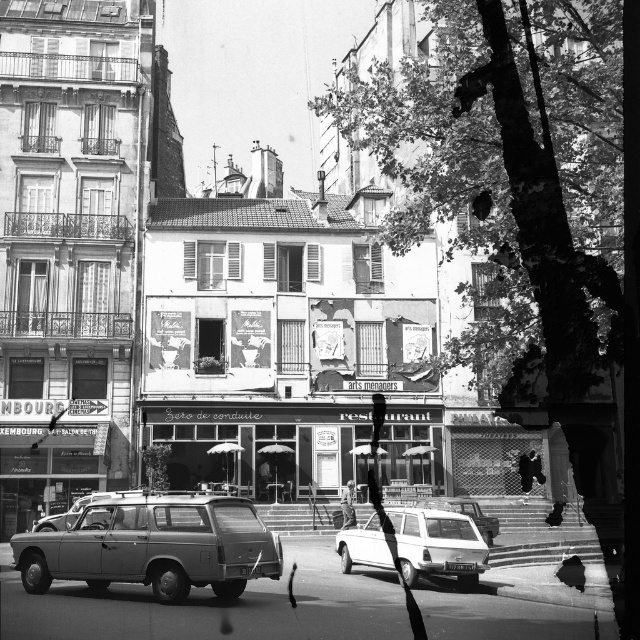
In the scene shown: You are a photographer standing at the center of the street facing the building with the restaurant. You notice two points marked on the building facade. The first point is at coordinate point (208, 516) and the second is at point (484, 563). Which of these two points is closer to your camera lens?

Point (208, 516) is closer to the camera than point (484, 563).

You are a delivery person trying to park your small van between the metallic gray station wagon at lower left and the white matte station wagon at center. Can you fit your van between them if your van is 1.8 meters wide?

The metallic gray station wagon at lower left is larger in size than the white matte station wagon at center, but the exact width between them isn not specified. Without knowing the distance between the two vehicles, it is impossible to determine if your van will fit.

You are a delivery person who needs to park a delivery van that is 2 meters wide. You see the metallic gray station wagon at lower left and the white matte station wagon at center. Is there enough space between them to park your van?

The metallic gray station wagon at lower left might be wider than the white matte station wagon at center, so there may not be enough space between them to park a 2 meter wide van.